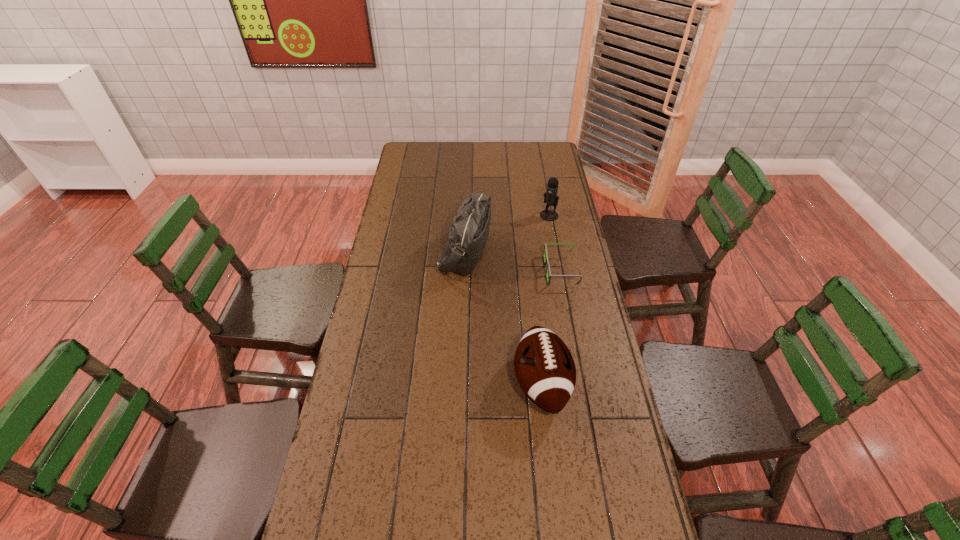
Identify the location of vacant position in the image that satisfies the following two spatial constraints: 1. on the back side of the microphone; 2. on the left side of the football (American). (523, 215).

The width and height of the screenshot is (960, 540). What are the coordinates of `free spot that satisfies the following two spatial constraints: 1. on the lens of the shortest object; 2. on the front side of the football (American)` in the screenshot? It's located at (582, 383).

Where is `vacant space that satisfies the following two spatial constraints: 1. on the lens of the spectacles; 2. on the front side of the nearest object`? vacant space that satisfies the following two spatial constraints: 1. on the lens of the spectacles; 2. on the front side of the nearest object is located at coordinates (582, 383).